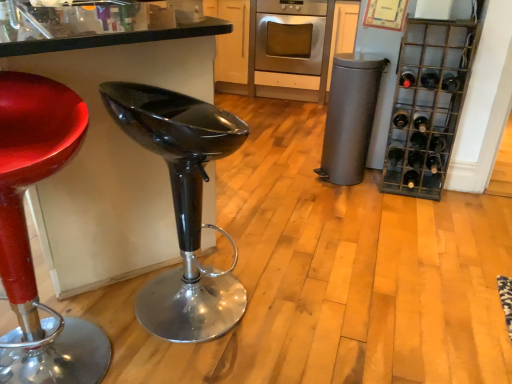
Question: Is black glass wine bottle at right, which is the sixth wine bottle in top-to-bottom order, in front of or behind dark red glass bottle at right, which is counted as the 10th wine bottle, starting from the bottom, in the image?

Choices:
 (A) front
 (B) behind

Answer: (B)

Question: Considering the positions of point (416, 147) and point (414, 79), is point (416, 147) closer or farther from the camera than point (414, 79)?

Choices:
 (A) closer
 (B) farther

Answer: (B)

Question: Estimate the real-world distances between objects in this image. Which object is closer to the dark red glass bottle at right, which is counted as the 10th wine bottle, starting from the bottom?

Choices:
 (A) black glass wine bottle at lower right, the 1th wine bottle from the bottom
 (B) dark brown glass bottle at right, which is counted as the third wine bottle, starting from the top
 (C) dark brown glass bottle at right, which is the seventh wine bottle from bottom to top
 (D) black glass bottle at right, positioned as the third wine bottle in bottom-to-top order
 (E) glossy black stool at center

Answer: (C)

Question: Which is nearer to the dark glass wine bottle at right, the 5th wine bottle viewed from the top?

Choices:
 (A) black glass wine bottle at lower right, the 1th wine bottle from the bottom
 (B) dark brown glass bottle at right, the seventh wine bottle viewed from the top
 (C) black glass bottle at right, positioned as the 8th wine bottle in top-to-bottom order
 (D) black glass wine bottle at right, acting as the fifth wine bottle starting from the bottom
 (E) dark brown glass bottle at right, which is counted as the 4th wine bottle, starting from the top

Answer: (D)